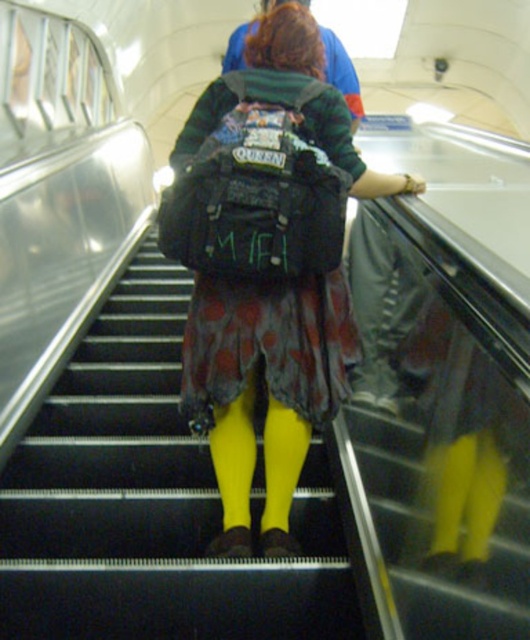
You are a delivery person carrying a box that is 1.8 meters long. You need to move from one end to the other end of the yellow fabric stairs at center. Can you move the box horizontally without tilting it?

The yellow fabric stairs at center are 1.72 meters apart. Since the box is 1.8 meters long, it cannot be moved horizontally without tilting as the distance between the stairs is shorter than the box length.